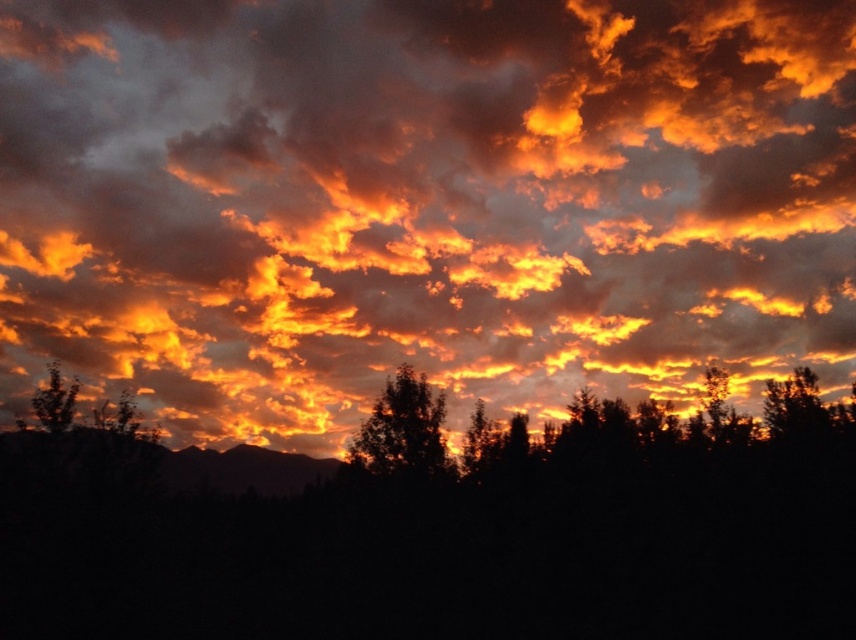
Question: Which point is farther to the camera?

Choices:
 (A) (678, 152)
 (B) (385, 460)

Answer: (A)

Question: Which point appears farthest from the camera in this image?

Choices:
 (A) (400, 365)
 (B) (259, 280)

Answer: (B)

Question: Which of the following is the closest to the observer?

Choices:
 (A) silhouette tree at center
 (B) silhouette leafy tree at left
 (C) glowing orange cloud at upper center

Answer: (C)

Question: Can you confirm if silhouette tree at center is wider than silhouette leafy tree at left?

Choices:
 (A) yes
 (B) no

Answer: (B)

Question: Is glowing orange cloud at upper center wider than silhouette tree at center?

Choices:
 (A) no
 (B) yes

Answer: (B)

Question: Is silhouette tree at center above silhouette leafy tree at left?

Choices:
 (A) yes
 (B) no

Answer: (B)